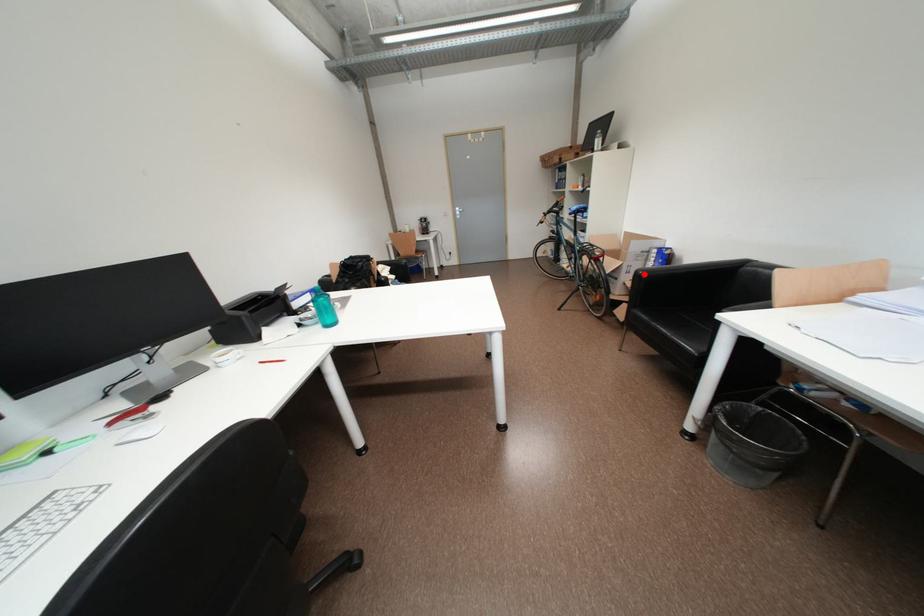
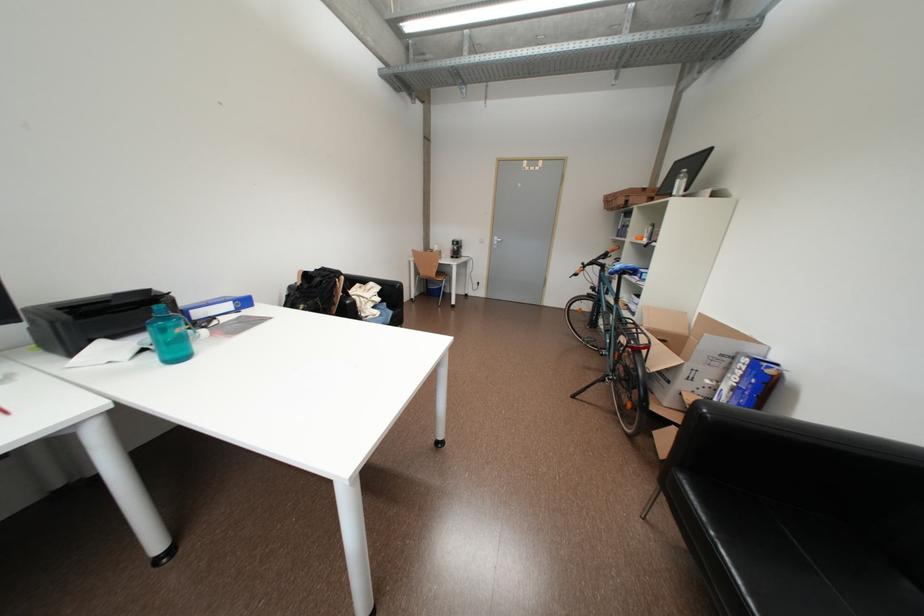
In the second image, find the point that corresponds to the highlighted location in the first image.

(704, 406)